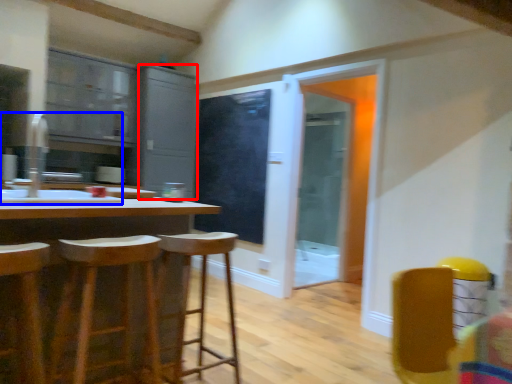
Question: Which object is further to the camera taking this photo, cabinetry (highlighted by a red box) or sink (highlighted by a blue box)?

Choices:
 (A) cabinetry
 (B) sink

Answer: (A)